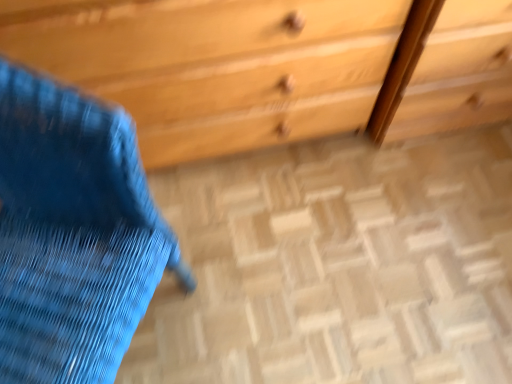
Question: From a real-world perspective, does blue fabric swivel chair at left stand above wooden chest of drawers at upper center?

Choices:
 (A) yes
 (B) no

Answer: (A)

Question: Considering the relative positions of blue fabric swivel chair at left and wooden chest of drawers at upper center in the image provided, is blue fabric swivel chair at left to the left of wooden chest of drawers at upper center from the viewer's perspective?

Choices:
 (A) no
 (B) yes

Answer: (B)

Question: Is blue fabric swivel chair at left positioned in front of wooden chest of drawers at upper center?

Choices:
 (A) yes
 (B) no

Answer: (A)

Question: Can you confirm if blue fabric swivel chair at left is wider than wooden chest of drawers at upper center?

Choices:
 (A) yes
 (B) no

Answer: (A)

Question: Is blue fabric swivel chair at left oriented towards wooden chest of drawers at upper center?

Choices:
 (A) no
 (B) yes

Answer: (A)

Question: Is blue fabric swivel chair at left positioned behind wooden chest of drawers at upper center?

Choices:
 (A) no
 (B) yes

Answer: (A)

Question: From a real-world perspective, is wooden floor at center located higher than blue fabric swivel chair at left?

Choices:
 (A) yes
 (B) no

Answer: (B)

Question: Is the depth of wooden floor at center greater than that of blue fabric swivel chair at left?

Choices:
 (A) no
 (B) yes

Answer: (B)

Question: Considering the relative sizes of wooden floor at center and blue fabric swivel chair at left in the image provided, is wooden floor at center wider than blue fabric swivel chair at left?

Choices:
 (A) yes
 (B) no

Answer: (A)

Question: Does wooden floor at center come in front of blue fabric swivel chair at left?

Choices:
 (A) no
 (B) yes

Answer: (A)

Question: Would you say wooden floor at center is a long distance from blue fabric swivel chair at left?

Choices:
 (A) yes
 (B) no

Answer: (B)

Question: Is blue fabric swivel chair at left completely or partially inside wooden floor at center?

Choices:
 (A) no
 (B) yes

Answer: (A)

Question: Is wooden chest of drawers at upper center oriented away from wooden floor at center?

Choices:
 (A) yes
 (B) no

Answer: (B)